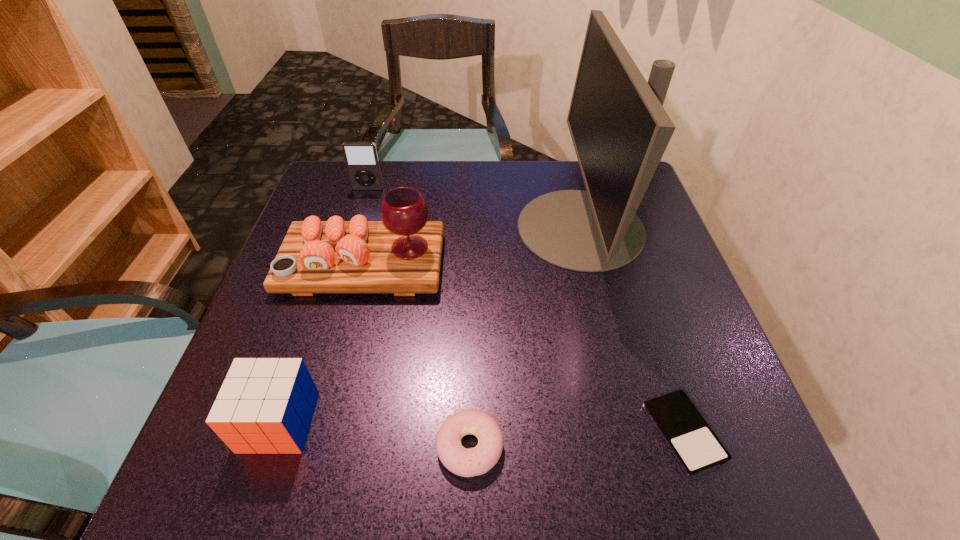
Identify the location of blank space located on the screen of the tallest object. This screenshot has width=960, height=540. (392, 228).

Identify the location of free space located 0.220m on the screen of the tallest object. (425, 228).

Identify the location of free spot located 0.380m on the front of the fifth shortest object. This screenshot has height=540, width=960. (301, 497).

Find the location of a particular element. This screenshot has height=540, width=960. free space located 0.150m on the front-facing side of the farther iPod is located at coordinates (356, 227).

Locate an element on the screen. vacant space situated on the right of the third shortest object is located at coordinates (447, 422).

The image size is (960, 540). I want to click on vacant region located on the left of the doughnut, so click(x=379, y=447).

This screenshot has width=960, height=540. Identify the location of vacant space located on the back of the shorter iPod. (659, 358).

This screenshot has width=960, height=540. Identify the location of computer monitor that is positioned at the far edge. 620,130.

Locate an element on the screen. The image size is (960, 540). iPod at the far edge is located at coordinates (361, 158).

The height and width of the screenshot is (540, 960). I want to click on cube positioned at the near edge, so click(265, 405).